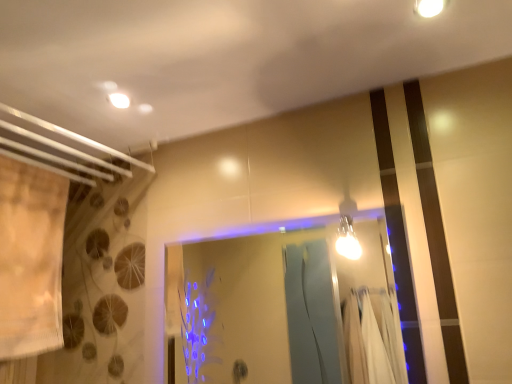
Question: Is matte white light fixture at upper left bigger than bright metallic bulb at upper right, acting as the 1th light fixture starting from the left?

Choices:
 (A) yes
 (B) no

Answer: (B)

Question: Can you confirm if matte white light fixture at upper left is positioned to the right of bright metallic bulb at upper right, which is the second light fixture from top to bottom?

Choices:
 (A) yes
 (B) no

Answer: (B)

Question: Does matte white light fixture at upper left touch bright metallic bulb at upper right, acting as the 1th light fixture starting from the left?

Choices:
 (A) yes
 (B) no

Answer: (B)

Question: Is matte white light fixture at upper left positioned with its back to bright metallic bulb at upper right, the 1th light fixture when ordered from bottom to top?

Choices:
 (A) yes
 (B) no

Answer: (B)

Question: Does matte white light fixture at upper left have a greater width compared to bright metallic bulb at upper right, which ranks as the second light fixture in right-to-left order?

Choices:
 (A) yes
 (B) no

Answer: (B)

Question: Is bright metallic bulb at upper right, which is the second light fixture from front to back, inside matte white light fixture at upper left?

Choices:
 (A) yes
 (B) no

Answer: (B)

Question: Does beige fabric shower curtain at left come in front of matte white light fixture at upper left?

Choices:
 (A) no
 (B) yes

Answer: (B)

Question: Does beige fabric shower curtain at left touch matte white light fixture at upper left?

Choices:
 (A) no
 (B) yes

Answer: (A)

Question: Would you consider beige fabric shower curtain at left to be distant from matte white light fixture at upper left?

Choices:
 (A) no
 (B) yes

Answer: (A)

Question: Does beige fabric shower curtain at left have a larger size compared to matte white light fixture at upper left?

Choices:
 (A) no
 (B) yes

Answer: (B)

Question: Can you confirm if beige fabric shower curtain at left is wider than matte white light fixture at upper left?

Choices:
 (A) yes
 (B) no

Answer: (A)

Question: From the image's perspective, would you say beige fabric shower curtain at left is positioned over matte white light fixture at upper left?

Choices:
 (A) yes
 (B) no

Answer: (B)

Question: From the image's perspective, is white glossy light fixture at upper right, which ranks as the 1th light fixture in top-to-bottom order, below beige fabric shower curtain at left?

Choices:
 (A) yes
 (B) no

Answer: (B)